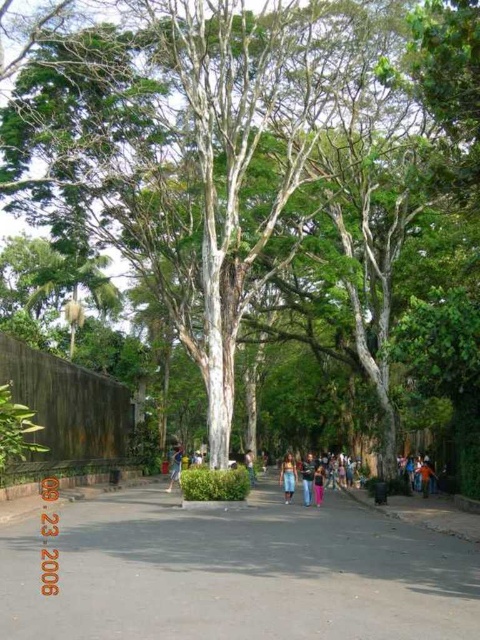
Between blue denim jeans at center and pink fabric pants at center, which one is positioned higher?

pink fabric pants at center

Which is in front, point (291, 476) or point (317, 477)?

Positioned in front is point (291, 476).

You are a GUI agent. You are given a task and a screenshot of the screen. Output one action in this format:
    pyautogui.click(x=<x>, y=<y>)
    Task: Click on the blue denim jeans at center
    This screenshot has width=480, height=640.
    Given the screenshot: What is the action you would take?
    pyautogui.click(x=288, y=476)

The height and width of the screenshot is (640, 480). Describe the element at coordinates (238, 573) in the screenshot. I see `gray asphalt pavement at center` at that location.

Which is behind, point (414, 556) or point (319, 486)?

The point (319, 486) is more distant.

At what (x,y) coordinates should I click in order to perform the action: click on gray asphalt pavement at center. Please return your answer as a coordinate pair (x, y). Looking at the image, I should click on click(x=238, y=573).

Who is taller, gray asphalt pavement at center or blue denim jeans at center?

Standing taller between the two is blue denim jeans at center.

Looking at this image, who is lower down, gray asphalt pavement at center or blue denim jeans at center?

Positioned lower is blue denim jeans at center.

Identify the location of gray asphalt pavement at center. The width and height of the screenshot is (480, 640). (238, 573).